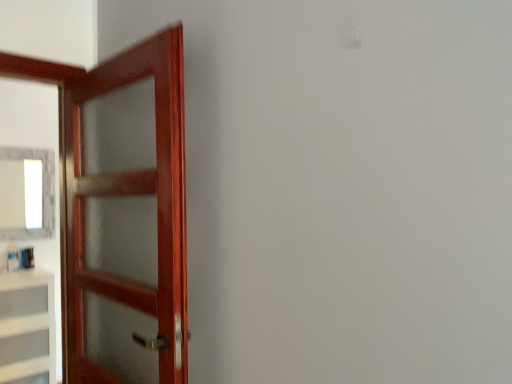
Question: Considering the relative positions of white glossy mirror at upper left and mahogany wood door at left in the image provided, is white glossy mirror at upper left to the right of mahogany wood door at left from the viewer's perspective?

Choices:
 (A) no
 (B) yes

Answer: (A)

Question: Is white glossy mirror at upper left oriented away from mahogany wood door at left?

Choices:
 (A) no
 (B) yes

Answer: (A)

Question: Does white glossy mirror at upper left contain mahogany wood door at left?

Choices:
 (A) yes
 (B) no

Answer: (B)

Question: Is white glossy mirror at upper left further to the viewer compared to mahogany wood door at left?

Choices:
 (A) no
 (B) yes

Answer: (B)

Question: Is white glossy mirror at upper left taller than mahogany wood door at left?

Choices:
 (A) yes
 (B) no

Answer: (B)

Question: Relative to white matte cabinet at left, is white glossy mirror at upper left in front or behind?

Choices:
 (A) behind
 (B) front

Answer: (A)

Question: From the image's perspective, is white glossy mirror at upper left positioned above or below white matte cabinet at left?

Choices:
 (A) above
 (B) below

Answer: (A)

Question: Is white glossy mirror at upper left bigger or smaller than white matte cabinet at left?

Choices:
 (A) big
 (B) small

Answer: (B)

Question: Would you say white glossy mirror at upper left is to the left or to the right of white matte cabinet at left in the picture?

Choices:
 (A) right
 (B) left

Answer: (B)

Question: From a real-world perspective, relative to mahogany wood door at left, is white glossy mirror at upper left vertically above or below?

Choices:
 (A) above
 (B) below

Answer: (A)

Question: Is white glossy mirror at upper left inside or outside of mahogany wood door at left?

Choices:
 (A) outside
 (B) inside

Answer: (A)

Question: In terms of height, does white glossy mirror at upper left look taller or shorter compared to mahogany wood door at left?

Choices:
 (A) tall
 (B) short

Answer: (B)

Question: From the image's perspective, is white glossy mirror at upper left located above or below mahogany wood door at left?

Choices:
 (A) below
 (B) above

Answer: (B)

Question: In terms of width, does white matte cabinet at left look wider or thinner when compared to white glossy mirror at upper left?

Choices:
 (A) thin
 (B) wide

Answer: (B)

Question: From the image's perspective, is white matte cabinet at left above or below white glossy mirror at upper left?

Choices:
 (A) above
 (B) below

Answer: (B)